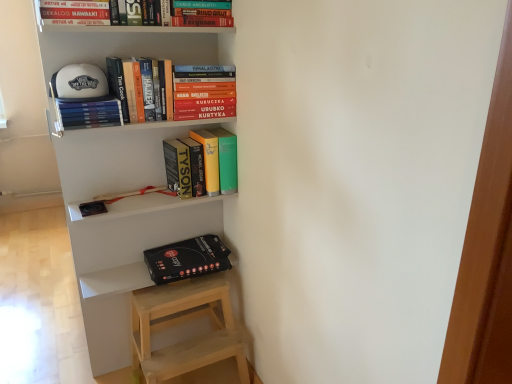
The height and width of the screenshot is (384, 512). Identify the location of free space above hardcover books at upper left, which is counted as the second book, starting from the bottom (from a real-world perspective). (86, 98).